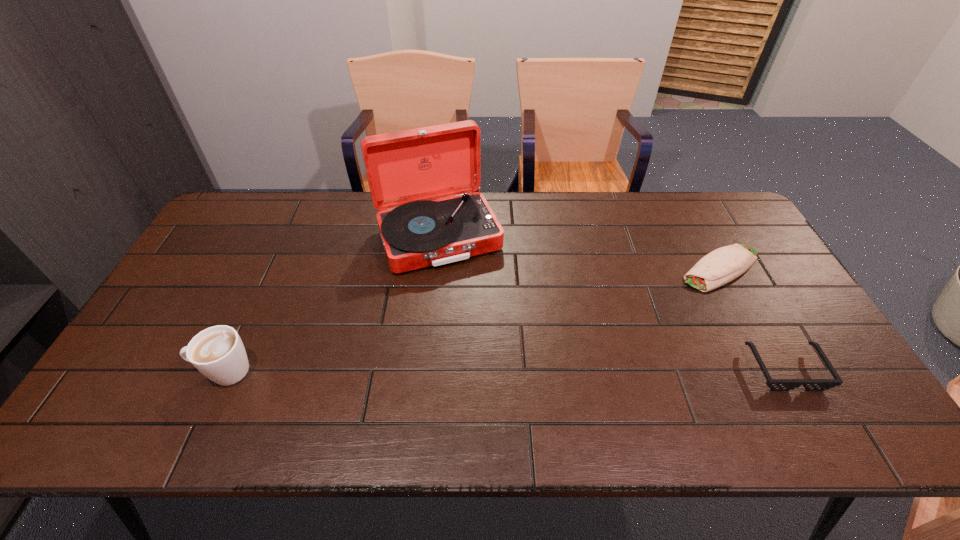
This screenshot has width=960, height=540. Find the location of `free spot on the desktop that is between the leftmost object and the sunglasses and is positioned at the bitten end of the burrito`. free spot on the desktop that is between the leftmost object and the sunglasses and is positioned at the bitten end of the burrito is located at coordinates (562, 369).

The width and height of the screenshot is (960, 540). In order to click on vacant space on the desktop that is between the third shortest object and the sunglasses and is positioned on the front-facing side of the second object from left to right in this screenshot , I will do `click(494, 370)`.